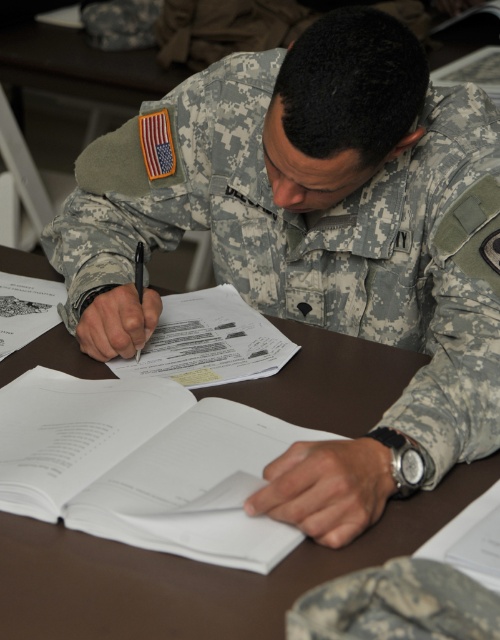
From the picture: Does brown wooden table at center appear under white paper book at center?

Actually, brown wooden table at center is above white paper book at center.

Is point (140, 596) closer to viewer compared to point (112, 493)?

Yes, it is.

You are a GUI agent. You are given a task and a screenshot of the screen. Output one action in this format:
    pyautogui.click(x=<x>, y=<y>)
    Task: Click on the brown wooden table at center
    The image size is (500, 640).
    Given the screenshot: What is the action you would take?
    pyautogui.click(x=196, y=573)

Where is `brown wooden table at center`? This screenshot has height=640, width=500. brown wooden table at center is located at coordinates (196, 573).

Does camouflage fabric uniform at center have a lesser height compared to brown wooden table at center?

In fact, camouflage fabric uniform at center may be taller than brown wooden table at center.

Between camouflage fabric uniform at center and brown wooden table at center, which one appears on the left side from the viewer's perspective?

brown wooden table at center

This screenshot has height=640, width=500. Describe the element at coordinates (319, 237) in the screenshot. I see `camouflage fabric uniform at center` at that location.

In order to click on camouflage fabric uniform at center in this screenshot , I will do `click(319, 237)`.

Is camouflage fabric uniform at center below white paper book at center?

Incorrect, camouflage fabric uniform at center is not positioned below white paper book at center.

Which of these two, camouflage fabric uniform at center or white paper book at center, stands shorter?

white paper book at center

Image resolution: width=500 pixels, height=640 pixels. What do you see at coordinates (319, 237) in the screenshot?
I see `camouflage fabric uniform at center` at bounding box center [319, 237].

Where is `camouflage fabric uniform at center`? This screenshot has height=640, width=500. camouflage fabric uniform at center is located at coordinates (319, 237).